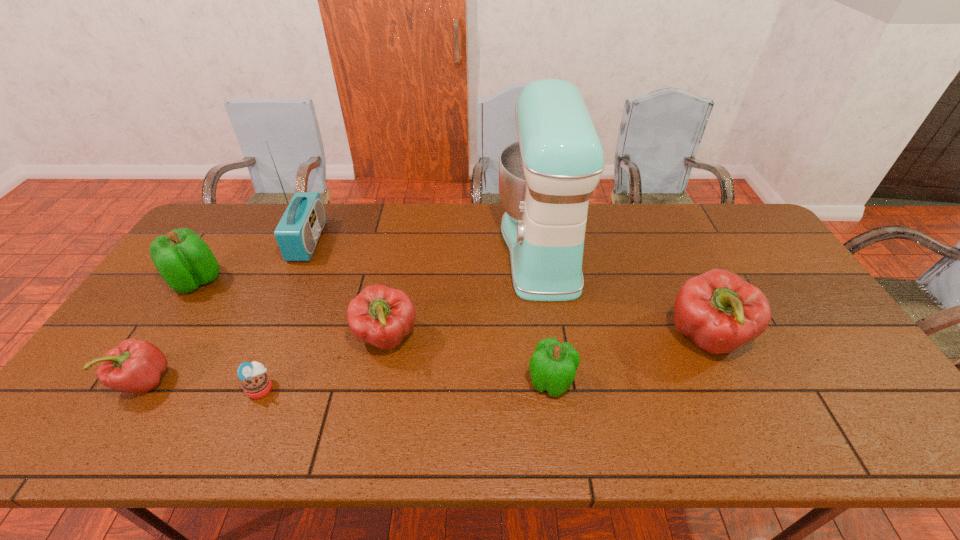
In the image, there is a desktop. At what (x,y) coordinates should I click in order to perform the action: click on vacant space at the right edge. Please return your answer as a coordinate pair (x, y). Looking at the image, I should click on (773, 281).

What are the coordinates of `free space at the far left corner of the desktop` in the screenshot? It's located at (235, 211).

Where is `vacant space at the near right corner`? vacant space at the near right corner is located at coordinates (896, 415).

I want to click on free space between the bigger green bell pepper and the shortest object, so click(229, 334).

The height and width of the screenshot is (540, 960). In order to click on free spot between the second pink bell pepper from right to left and the leftmost pink bell pepper in this screenshot , I will do `click(266, 360)`.

I want to click on empty space that is in between the rightmost object and the fifth object from left to right, so click(546, 339).

The image size is (960, 540). What are the coordinates of `free space between the left green bell pepper and the seventh shortest object` in the screenshot? It's located at (252, 261).

Find the location of `vacant area that lies between the biggest pink bell pepper and the left green bell pepper`. vacant area that lies between the biggest pink bell pepper and the left green bell pepper is located at coordinates (451, 310).

In order to click on free space between the leftmost pink bell pepper and the radio receiver in this screenshot , I will do `click(227, 311)`.

Image resolution: width=960 pixels, height=540 pixels. Find the location of `free spot between the third bell pepper from right to left and the rightmost pink bell pepper`. free spot between the third bell pepper from right to left and the rightmost pink bell pepper is located at coordinates (546, 339).